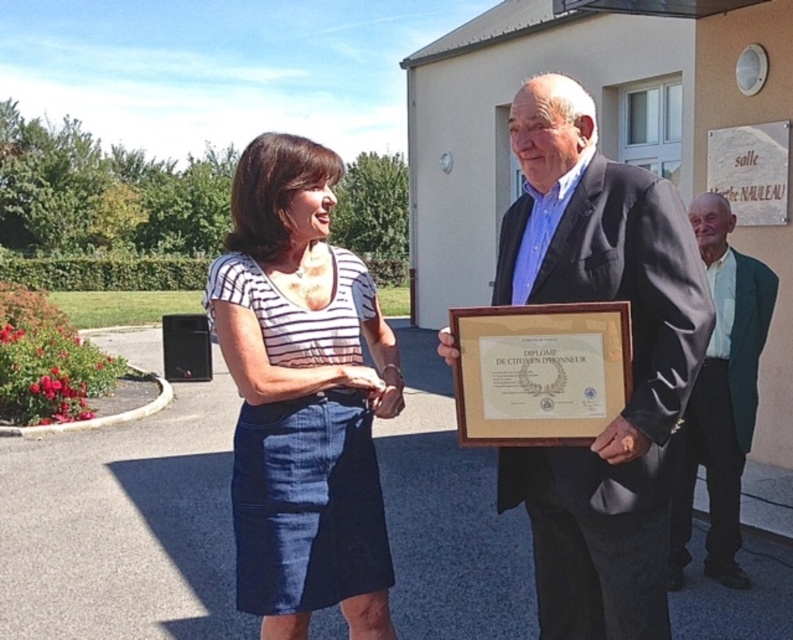
The image size is (793, 640). Find the location of `matte black suit at center`. matte black suit at center is located at coordinates (631, 364).

Between matte black suit at center and striped cotton shirt at center, which one appears on the right side from the viewer's perspective?

Positioned to the right is matte black suit at center.

Is point (695, 266) closer to viewer compared to point (361, 435)?

Yes, point (695, 266) is in front of point (361, 435).

The image size is (793, 640). In order to click on matte black suit at center in this screenshot , I will do `click(631, 364)`.

Which of these two, matte black suit at center or green textured blazer at lower right, stands taller?

Standing taller between the two is green textured blazer at lower right.

Is matte black suit at center wider than green textured blazer at lower right?

No, matte black suit at center is not wider than green textured blazer at lower right.

The image size is (793, 640). I want to click on matte black suit at center, so click(631, 364).

What are the coordinates of `matte black suit at center` in the screenshot? It's located at (631, 364).

Is striped cotton shirt at center shorter than green textured blazer at lower right?

Indeed, striped cotton shirt at center has a lesser height compared to green textured blazer at lower right.

Is the position of striped cotton shirt at center more distant than that of green textured blazer at lower right?

No, it is not.

Where is `striped cotton shirt at center`? striped cotton shirt at center is located at coordinates (301, 397).